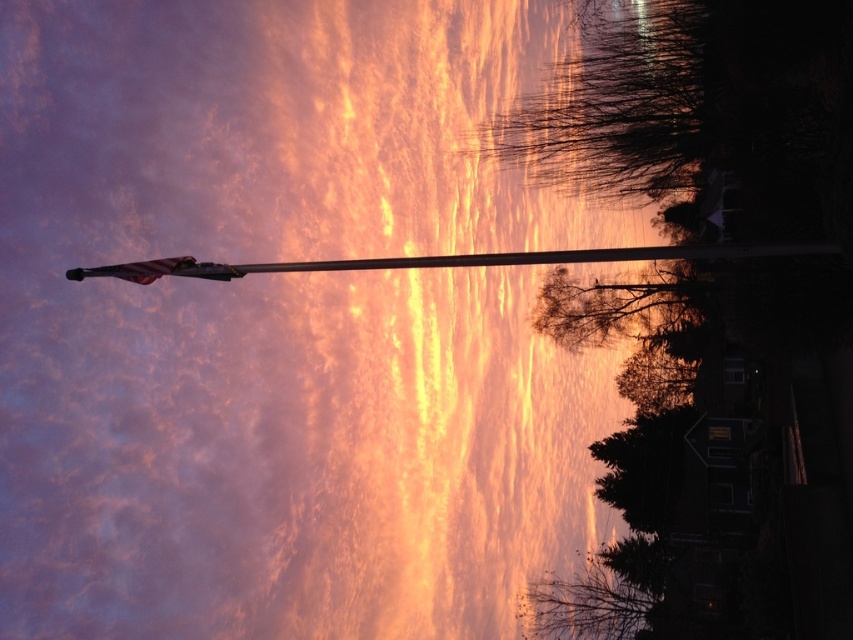
Image resolution: width=853 pixels, height=640 pixels. Describe the element at coordinates (440, 260) in the screenshot. I see `metallic flag pole at center` at that location.

Which is more to the right, metallic flag pole at center or american flag at upper left?

metallic flag pole at center

You are a GUI agent. You are given a task and a screenshot of the screen. Output one action in this format:
    pyautogui.click(x=<x>, y=<y>)
    Task: Click on the metallic flag pole at center
    The image size is (853, 640).
    Given the screenshot: What is the action you would take?
    pyautogui.click(x=440, y=260)

The height and width of the screenshot is (640, 853). What are the coordinates of `metallic flag pole at center` in the screenshot? It's located at (440, 260).